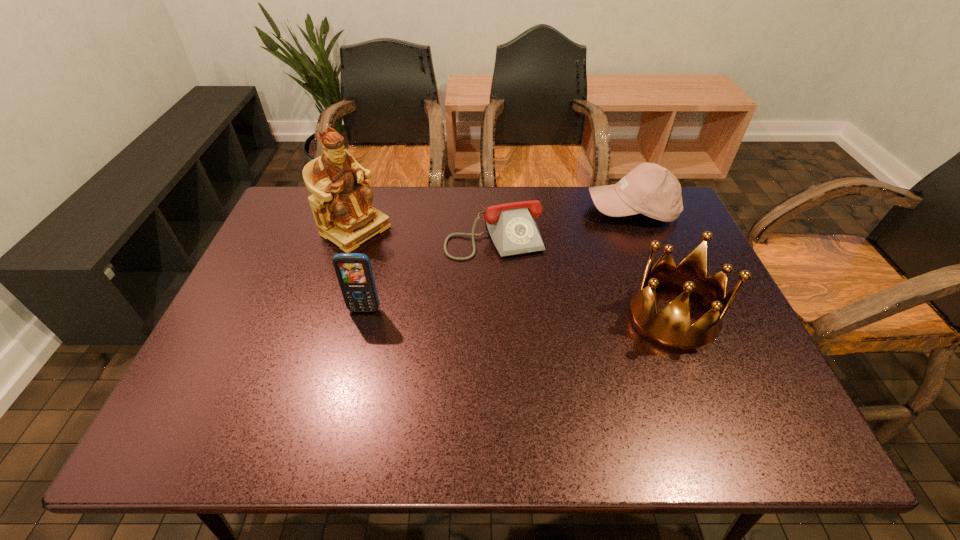
In order to click on cellular telephone in this screenshot , I will do `click(354, 273)`.

Identify the location of crown. The height and width of the screenshot is (540, 960). (670, 328).

Where is `figurine`? The width and height of the screenshot is (960, 540). figurine is located at coordinates (341, 203).

You are a GUI agent. You are given a task and a screenshot of the screen. Output one action in this format:
    pyautogui.click(x=<x>, y=<y>)
    Task: Click on the third object from right to left
    The height and width of the screenshot is (540, 960).
    Given the screenshot: What is the action you would take?
    pyautogui.click(x=512, y=227)

Where is `telephone`? The width and height of the screenshot is (960, 540). telephone is located at coordinates (512, 227).

Identify the location of the fourth tallest object. (x=649, y=189).

Identify the location of free space located on the screen of the cellular telephone. (349, 374).

At what (x,y) coordinates should I click in order to perform the action: click on vacant space located on the left of the crown. Please return your answer as a coordinate pair (x, y). Looking at the image, I should click on (487, 317).

The width and height of the screenshot is (960, 540). I want to click on blank space located 0.320m on the front-facing side of the tallest object, so click(x=459, y=300).

Identify the location of vacant space located on the front-facing side of the tallest object. (408, 266).